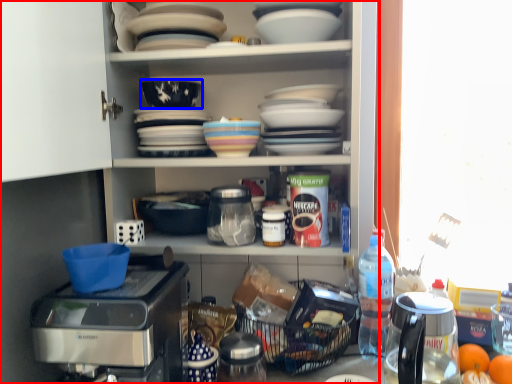
Question: Among these objects, which one is farthest to the camera, cabinetry (highlighted by a red box) or bowl (highlighted by a blue box)?

Choices:
 (A) cabinetry
 (B) bowl

Answer: (B)